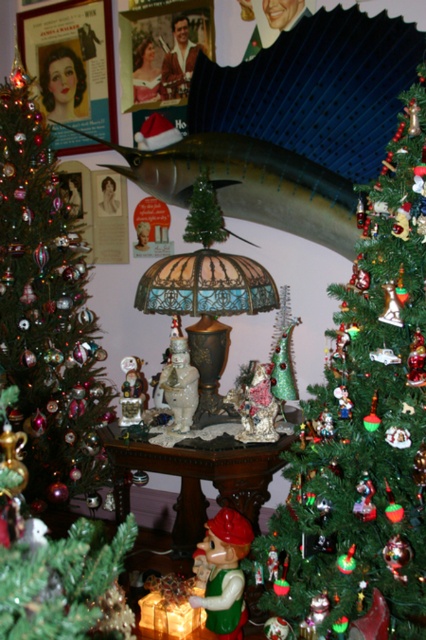
Question: Can you confirm if green matte christmas tree at center is positioned above porcelain snowman at center?

Choices:
 (A) no
 (B) yes

Answer: (B)

Question: Based on their relative distances, which object is farther from the green matte christmas tree at center?

Choices:
 (A) matte porcelain figurine at center
 (B) porcelain snowman at center
 (C) shiny green christmas tree at left

Answer: (C)

Question: Which is nearer to the shiny green christmas tree at left?

Choices:
 (A) matte porcelain figurine at center
 (B) green matte christmas tree at center
 (C) green matte figurine at lower center

Answer: (A)

Question: Among these objects, which one is farthest from the camera?

Choices:
 (A) shiny green christmas tree at left
 (B) matte porcelain figurine at center

Answer: (A)

Question: Is green matte christmas tree at center to the left of matte porcelain figurine at center from the viewer's perspective?

Choices:
 (A) no
 (B) yes

Answer: (A)

Question: Can you confirm if shiny green christmas tree at left is bigger than matte porcelain figurine at center?

Choices:
 (A) no
 (B) yes

Answer: (B)